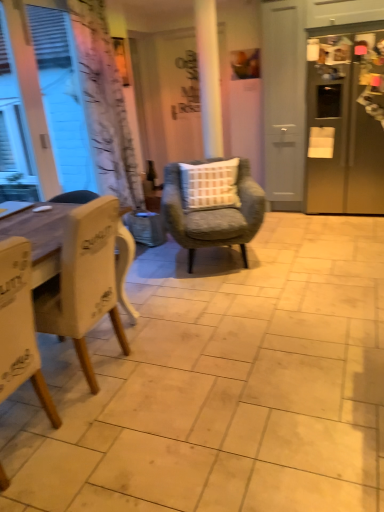
Identify the location of vacant space underneath white wood chair at left, the second chair when ordered from front to back (from a real-world perspective). (91, 367).